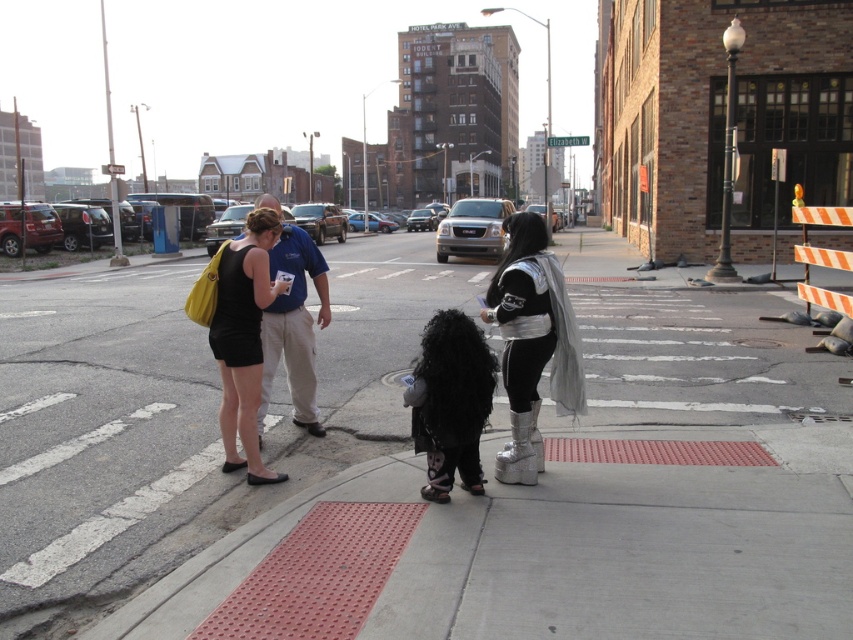
Question: Does black matte dress at center appear under blue cotton shirt at center?

Choices:
 (A) no
 (B) yes

Answer: (B)

Question: Which point is farther to the camera?

Choices:
 (A) (326, 493)
 (B) (254, 403)
 (C) (531, 404)

Answer: (B)

Question: Where is black matte dress at center located in relation to blue cotton shirt at center in the image?

Choices:
 (A) below
 (B) above

Answer: (A)

Question: Does silver metallic platform boots at center have a lesser width compared to blue cotton shirt at center?

Choices:
 (A) no
 (B) yes

Answer: (B)

Question: Which object is farther from the camera taking this photo?

Choices:
 (A) blue cotton shirt at center
 (B) smooth concrete sidewalk at center
 (C) silver metallic platform boots at center

Answer: (A)

Question: Which of the following is the farthest from the observer?

Choices:
 (A) black matte dress at center
 (B) smooth concrete sidewalk at center

Answer: (A)